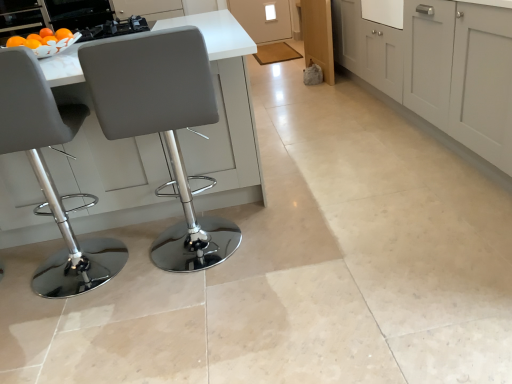
Question: Looking at the image, does matte gray stool at left, the second chair from the right, seem bigger or smaller compared to metallic black stove at upper left?

Choices:
 (A) small
 (B) big

Answer: (B)

Question: Is matte gray stool at left, the second chair from the right, wider or thinner than metallic black stove at upper left?

Choices:
 (A) wide
 (B) thin

Answer: (A)

Question: Which of these objects is positioned farthest from the metallic black stove at upper left?

Choices:
 (A) white matte cabinet at upper center, the first cabinetry when ordered from left to right
 (B) matte gray cabinets at center, arranged as the 1th cabinetry when viewed from the right
 (C) matte gray stool at left, arranged as the 1th chair when viewed from the left
 (D) matte gray chair at left, which is the first chair in right-to-left order

Answer: (B)

Question: Which is nearer to the matte gray cabinets at center, which appears as the second cabinetry when viewed from the top?

Choices:
 (A) matte gray stool at left, arranged as the 1th chair when viewed from the left
 (B) white matte cabinet at upper center, the first cabinetry when ordered from left to right
 (C) metallic black stove at upper left
 (D) matte gray chair at left, the second chair in the left-to-right sequence

Answer: (D)